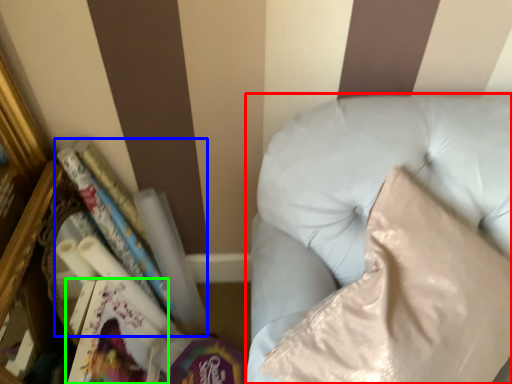
Question: Based on their relative distances, which object is nearer to furniture (highlighted by a red box)? Choose from book (highlighted by a blue box) and paperback book (highlighted by a green box).

Choices:
 (A) book
 (B) paperback book

Answer: (A)